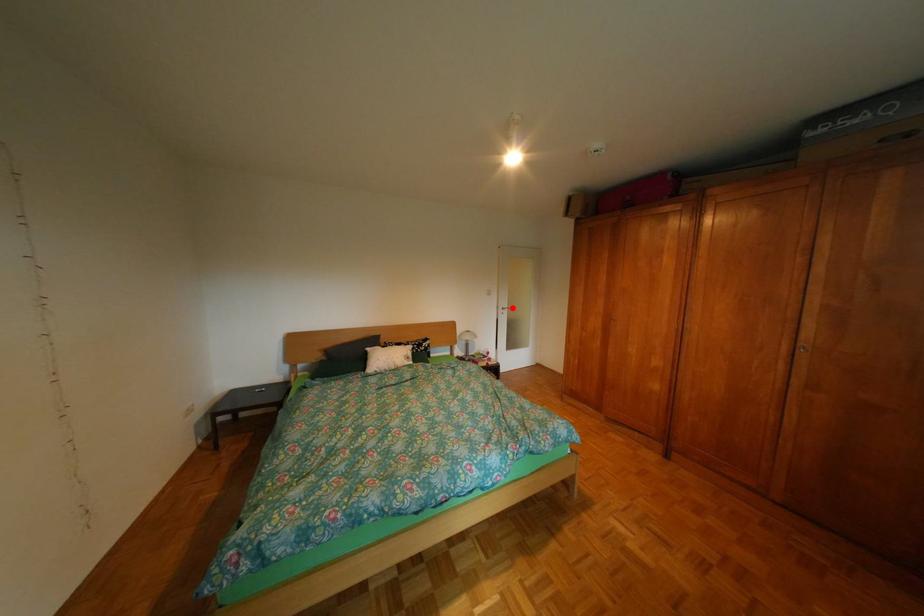
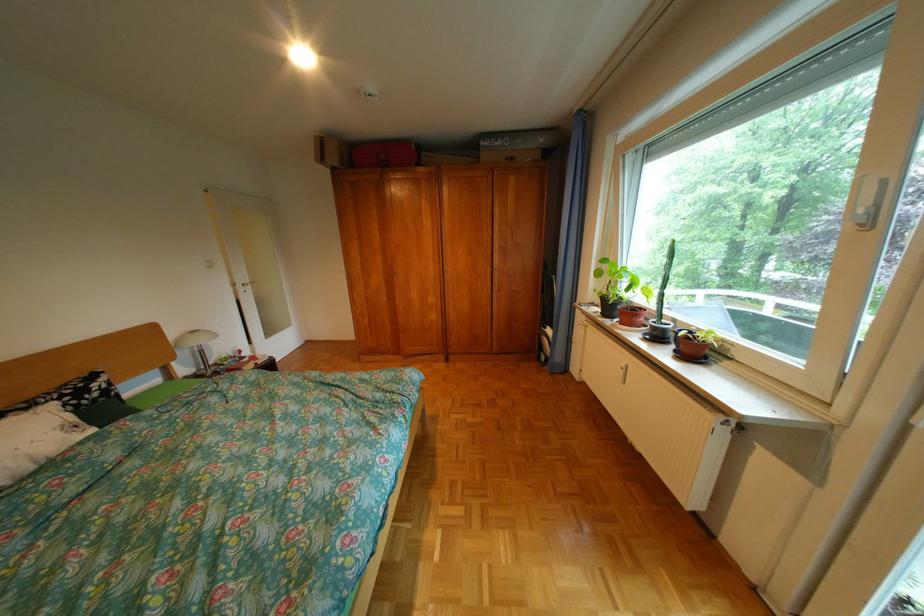
Locate, in the second image, the point that corresponds to the highlighted location in the first image.

(248, 285)